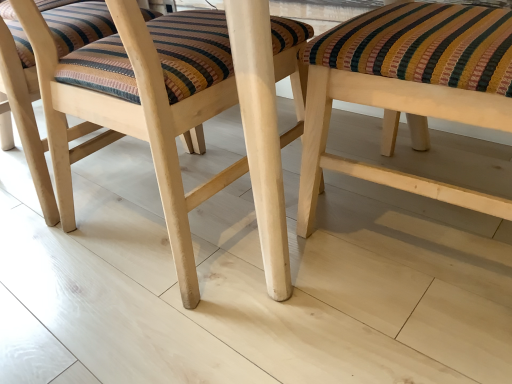
Question: From the image's perspective, would you say natural wood stool at center, the 2th stool from the right, is positioned over wooden stool at center, placed as the 1th stool when sorted from right to left?

Choices:
 (A) yes
 (B) no

Answer: (A)

Question: Are natural wood stool at center, the 2th stool from the right, and wooden stool at center, which ranks as the 2th stool in left-to-right order, making contact?

Choices:
 (A) yes
 (B) no

Answer: (B)

Question: From a real-world perspective, is natural wood stool at center, the 2th stool from the right, positioned over wooden stool at center, placed as the 1th stool when sorted from right to left, based on gravity?

Choices:
 (A) yes
 (B) no

Answer: (A)

Question: Considering the relative positions of natural wood stool at center, the 2th stool from the right, and wooden stool at center, which ranks as the 2th stool in left-to-right order, in the image provided, is natural wood stool at center, the 2th stool from the right, behind wooden stool at center, which ranks as the 2th stool in left-to-right order,?

Choices:
 (A) yes
 (B) no

Answer: (A)

Question: Can you confirm if natural wood stool at center, the 1th stool positioned from the left, is wider than wooden stool at center, placed as the 1th stool when sorted from right to left?

Choices:
 (A) no
 (B) yes

Answer: (B)

Question: Considering the relative sizes of natural wood stool at center, the 1th stool positioned from the left, and wooden stool at center, which ranks as the 2th stool in left-to-right order, in the image provided, is natural wood stool at center, the 1th stool positioned from the left, smaller than wooden stool at center, which ranks as the 2th stool in left-to-right order,?

Choices:
 (A) no
 (B) yes

Answer: (A)

Question: Is natural wood stool at center, the 2th stool from the right, surrounded by wooden stool at center, placed as the 1th stool when sorted from right to left?

Choices:
 (A) yes
 (B) no

Answer: (B)

Question: Does wooden stool at center, placed as the 1th stool when sorted from right to left, lie in front of natural wood stool at center, the 2th stool from the right?

Choices:
 (A) yes
 (B) no

Answer: (A)

Question: Does wooden stool at center, placed as the 1th stool when sorted from right to left, appear on the right side of natural wood stool at center, the 1th stool positioned from the left?

Choices:
 (A) no
 (B) yes

Answer: (B)

Question: Considering the relative sizes of wooden stool at center, placed as the 1th stool when sorted from right to left, and natural wood stool at center, the 2th stool from the right, in the image provided, is wooden stool at center, placed as the 1th stool when sorted from right to left, thinner than natural wood stool at center, the 2th stool from the right,?

Choices:
 (A) yes
 (B) no

Answer: (A)

Question: From a real-world perspective, is wooden stool at center, placed as the 1th stool when sorted from right to left, positioned over natural wood stool at center, the 2th stool from the right, based on gravity?

Choices:
 (A) yes
 (B) no

Answer: (B)

Question: Is wooden stool at center, placed as the 1th stool when sorted from right to left, completely or partially outside of natural wood stool at center, the 1th stool positioned from the left?

Choices:
 (A) no
 (B) yes

Answer: (B)

Question: Considering their positions, is wooden stool at center, placed as the 1th stool when sorted from right to left, located in front of or behind natural wood stool at center, the 1th stool positioned from the left?

Choices:
 (A) behind
 (B) front

Answer: (B)